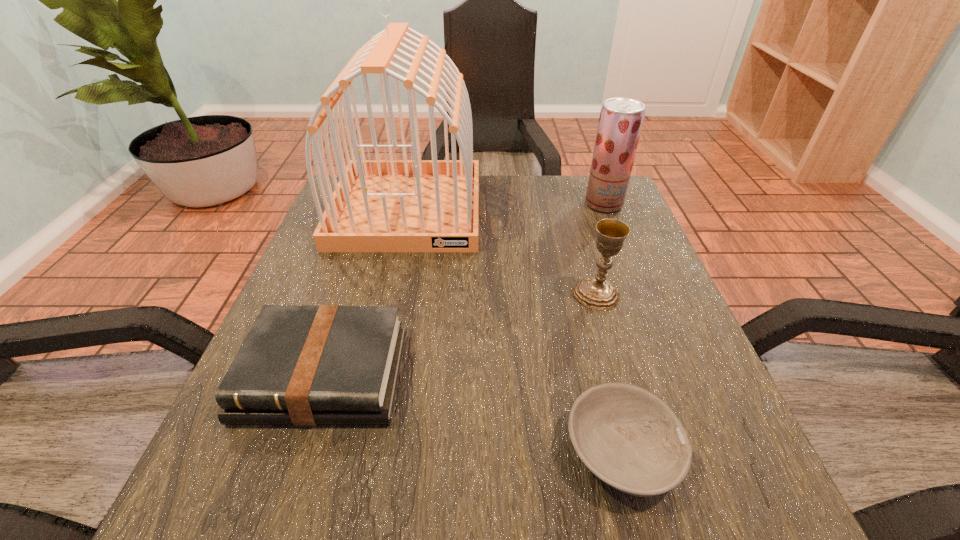
This screenshot has height=540, width=960. I want to click on free space located 0.060m on the right of the bowl, so click(722, 451).

The image size is (960, 540). I want to click on birdcage at the far edge, so click(x=417, y=205).

Where is `fruit juice at the far edge`? This screenshot has width=960, height=540. fruit juice at the far edge is located at coordinates (621, 119).

Identify the location of object located at the near edge. (629, 438).

Where is `birdcage located at the left edge`? This screenshot has height=540, width=960. birdcage located at the left edge is located at coordinates (417, 205).

Where is `hardback book located in the left edge section of the desktop`? Image resolution: width=960 pixels, height=540 pixels. hardback book located in the left edge section of the desktop is located at coordinates (299, 365).

Where is `fruit juice that is at the right edge`? fruit juice that is at the right edge is located at coordinates (621, 119).

Find the location of a particular element. This screenshot has height=540, width=960. chalice that is at the right edge is located at coordinates (596, 292).

Image resolution: width=960 pixels, height=540 pixels. Find the location of `bowl that is at the right edge`. bowl that is at the right edge is located at coordinates (629, 438).

Identify the location of object present at the far left corner. (417, 205).